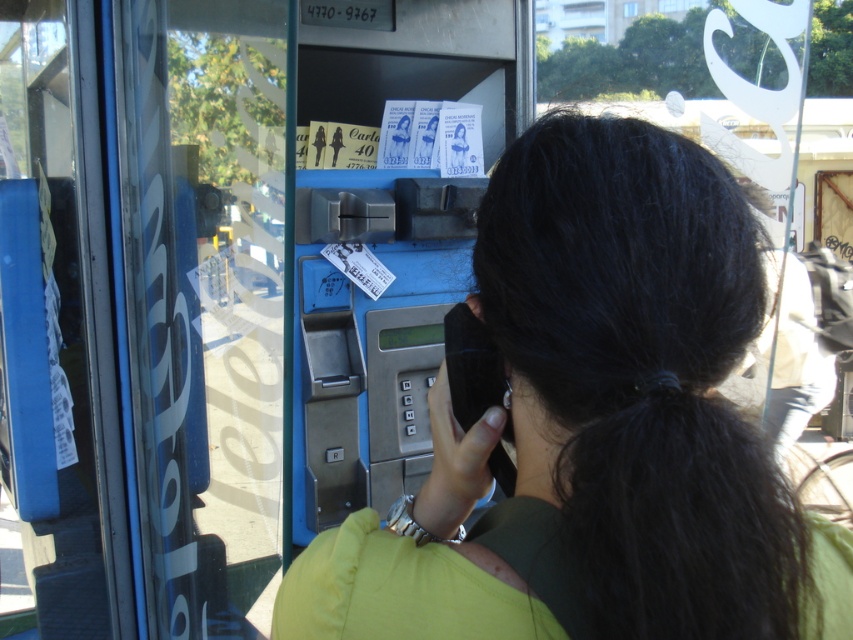
You are a photographer trying to capture a clear photo of the blue metallic phone box at center. However, the green fabric shirt at center is blocking your view. Can you estimate whether the shirt is wider than the phone box, making it harder to move around it?

The green fabric shirt at center is wider than blue metallic phone box at center, so it is harder to move around it.

You are standing at the payphone booth and want to reach the two points marked in the image. Which point, point [444,497] or point [415,272], is closer to you?

Point [444,497] is in front of point [415,272], so it is closer to you.

You are standing in front of the payphone booth and notice the point marked at coordinates (x=596, y=426). What object is located at that point?

The point at coordinates (x=596, y=426) marks the green fabric shirt at center.